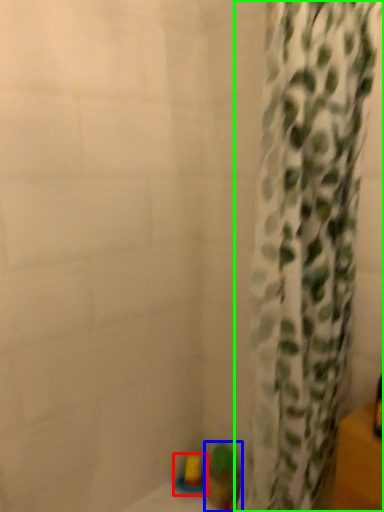
Question: Which is nearer to the toy (highlighted by a red box)? toy (highlighted by a blue box) or curtain (highlighted by a green box).

Choices:
 (A) toy
 (B) curtain

Answer: (A)